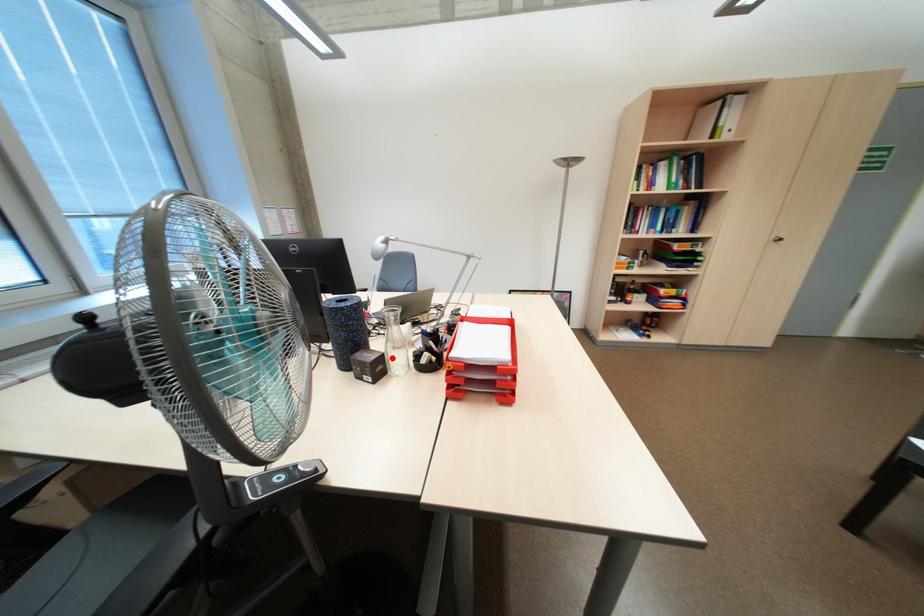
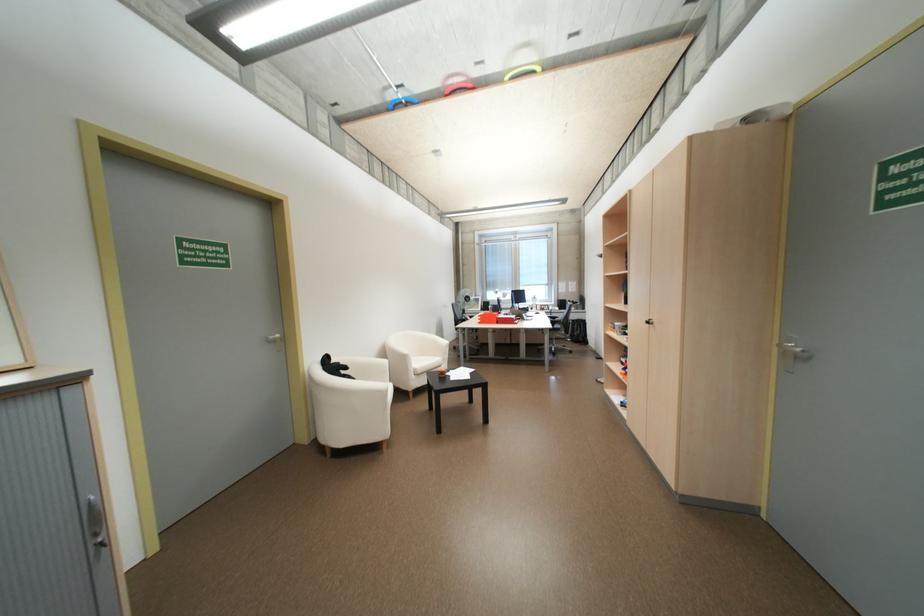
Question: I am providing you with two images of the same scene from different viewpoints. A red point is marked on the first image. Can you still see the location of the red point in image 2?

Choices:
 (A) Yes
 (B) No

Answer: (B)